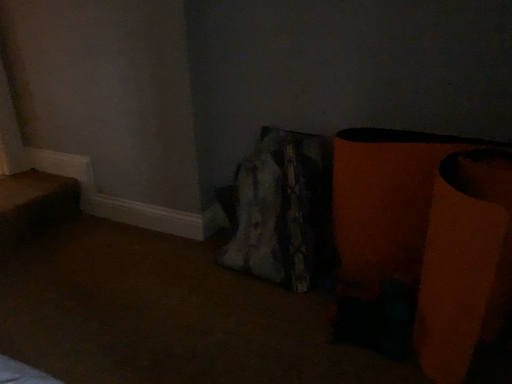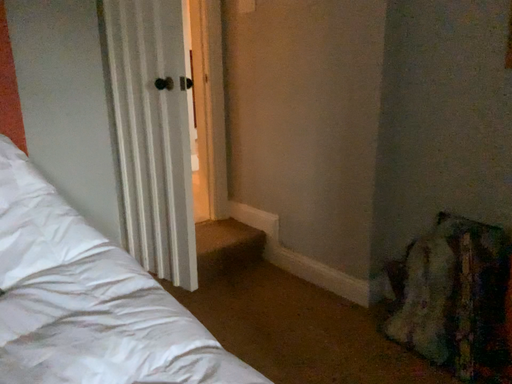
Question: Which way did the camera rotate in the video?

Choices:
 (A) rotated left
 (B) rotated right

Answer: (A)